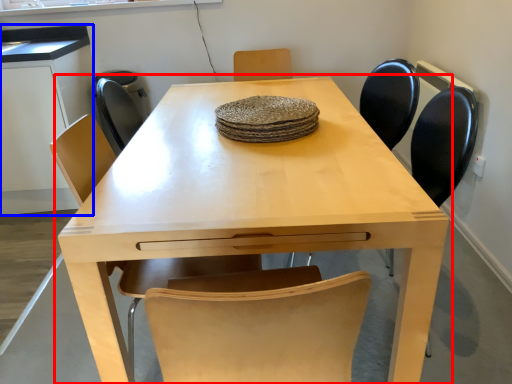
Question: Which point is further to the camera, table (highlighted by a red box) or computer desk (highlighted by a blue box)?

Choices:
 (A) table
 (B) computer desk

Answer: (B)